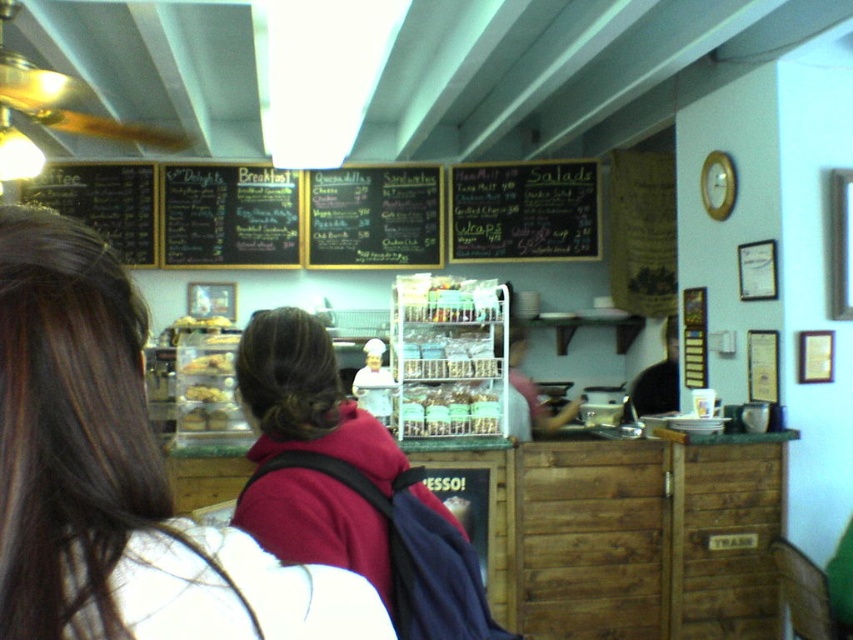
Based on the photo, you are a customer at the cafe and want to read the menu. The menu is on the black chalkboard menu at center, and there are translucent plastic containers at center nearby. Which object is wider?

The black chalkboard menu at center is wider than the translucent plastic containers at center.

What is located at the coordinates point (x=375, y=218) in the image?

The black chalkboard menu at center is located at point (x=375, y=218).